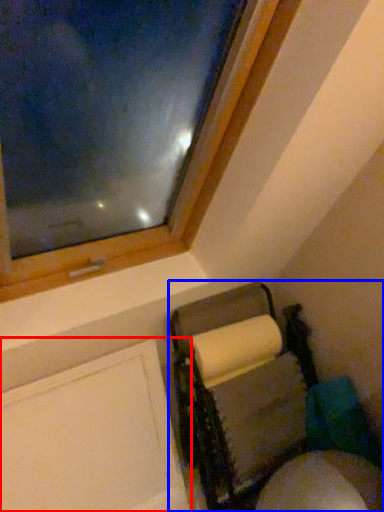
Question: Which point is further to the camera, screen door (highlighted by a red box) or furniture (highlighted by a blue box)?

Choices:
 (A) screen door
 (B) furniture

Answer: (B)